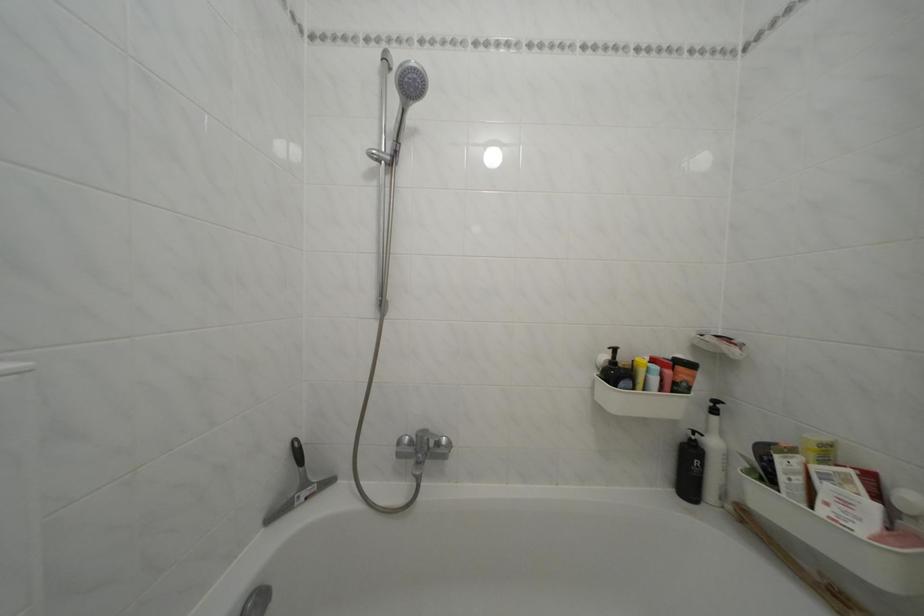
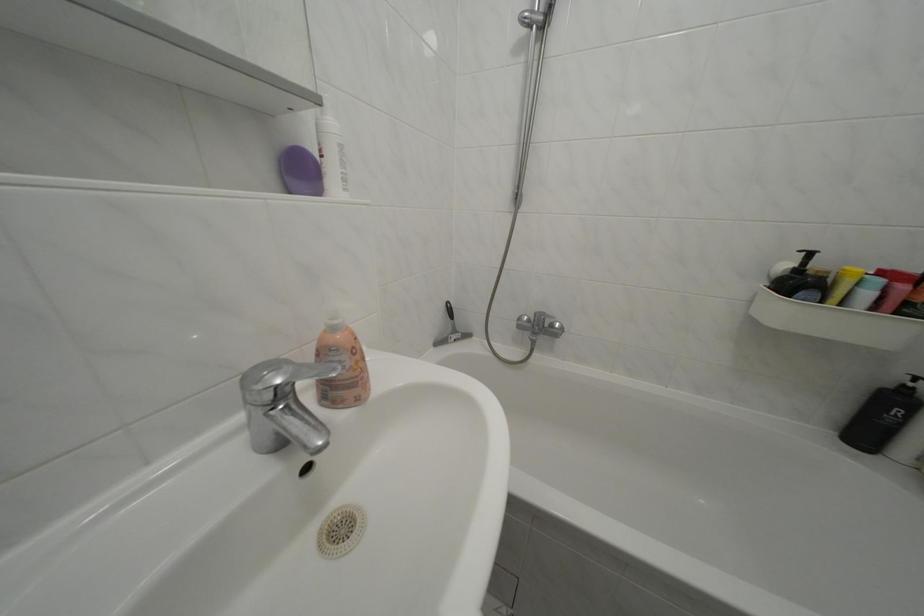
The point at (447, 450) is marked in the first image. Where is the corresponding point in the second image?

(562, 331)